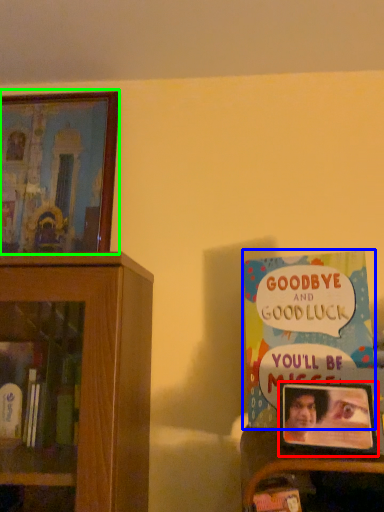
Question: Based on their relative distances, which object is farther from picture frame (highlighted by a red box)? Choose from book (highlighted by a blue box) and picture frame (highlighted by a green box).

Choices:
 (A) book
 (B) picture frame

Answer: (B)